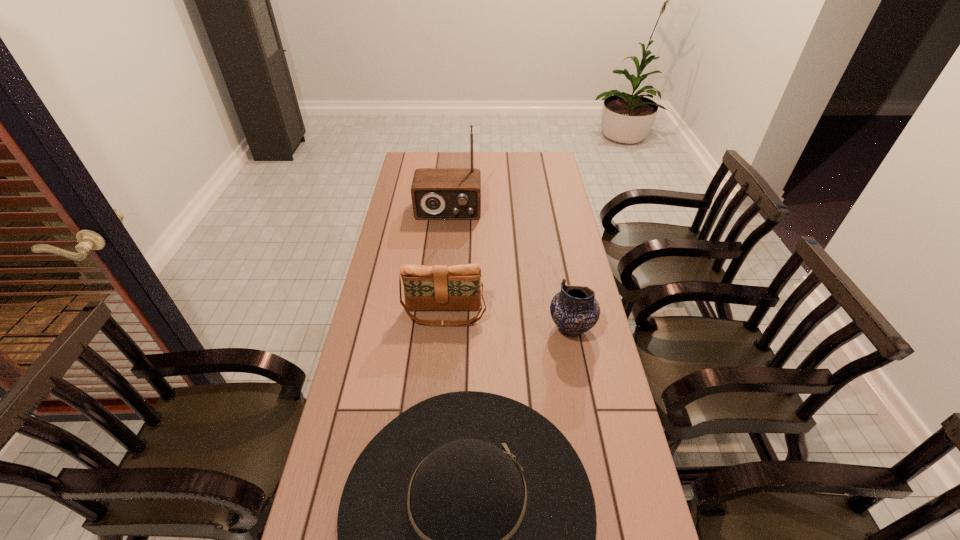
You are a GUI agent. You are given a task and a screenshot of the screen. Output one action in this format:
    pyautogui.click(x=<x>, y=<y>)
    Task: Click on the vacant area at the far edge
    
    Given the screenshot: What is the action you would take?
    pyautogui.click(x=508, y=171)

Find the location of a particular element. The image size is (960, 540). vacant space at the left edge is located at coordinates (387, 363).

In order to click on vacant region at the right edge of the desktop in this screenshot , I will do `click(595, 430)`.

Identify the location of free space between the farthest object and the pottery. (510, 269).

At what (x,y) coordinates should I click in order to perform the action: click on blank region between the pottery and the shoulder bag. Please return your answer as a coordinate pair (x, y). This screenshot has width=960, height=540. Looking at the image, I should click on (508, 321).

You are a GUI agent. You are given a task and a screenshot of the screen. Output one action in this format:
    pyautogui.click(x=<x>, y=<y>)
    Task: Click on the free area in between the shoulder bag and the tallest object
    This screenshot has width=960, height=540.
    Given the screenshot: What is the action you would take?
    pyautogui.click(x=446, y=262)

Identify the location of free spot between the shoulder bag and the pottery. (508, 321).

I want to click on vacant space in between the shoulder bag and the pottery, so click(x=508, y=321).

Find the location of a particular element. object that ranks as the second closest to the nearest object is located at coordinates (438, 287).

Identify the location of object that is the closest to the radio receiver. The height and width of the screenshot is (540, 960). (438, 287).